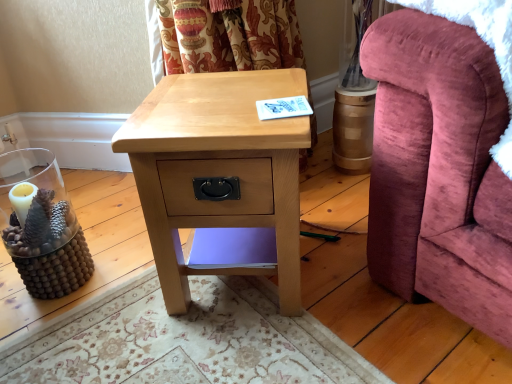
Measure the distance between natural wood nightstand at center and camera.

natural wood nightstand at center and camera are 73.53 centimeters apart.

Measure the distance between point (174, 128) and camera.

Point (174, 128) is 30.39 inches from camera.

Describe the element at coordinates (220, 176) in the screenshot. I see `natural wood nightstand at center` at that location.

I want to click on natural wood nightstand at center, so click(220, 176).

This screenshot has height=384, width=512. Identify the location of velvet pink armchair at right. (439, 169).

Consider the image. What is the approximate height of velvet pink armchair at right?

velvet pink armchair at right is 38.85 centimeters in height.

The width and height of the screenshot is (512, 384). Describe the element at coordinates (439, 169) in the screenshot. I see `velvet pink armchair at right` at that location.

Where is `natural wood nightstand at center`? The width and height of the screenshot is (512, 384). natural wood nightstand at center is located at coordinates (220, 176).

Looking at this image, does velvet pink armchair at right appear on the right side of natural wood nightstand at center?

Yes.

Looking at this image, considering their positions, is velvet pink armchair at right located in front of or behind natural wood nightstand at center?

Visually, velvet pink armchair at right is located in front of natural wood nightstand at center.

Between point (399, 28) and point (187, 155), which one is positioned in front?

The point (399, 28) is more forward.

From the image's perspective, which is above, velvet pink armchair at right or natural wood nightstand at center?

velvet pink armchair at right is shown above in the image.

From the picture: From a real-world perspective, is velvet pink armchair at right over natural wood nightstand at center?

Yes, from a real-world perspective, velvet pink armchair at right is over natural wood nightstand at center

Which object is thinner, velvet pink armchair at right or natural wood nightstand at center?

natural wood nightstand at center is thinner.

Between velvet pink armchair at right and natural wood nightstand at center, which one has less height?

velvet pink armchair at right.

Who is smaller, velvet pink armchair at right or natural wood nightstand at center?

Smaller between the two is natural wood nightstand at center.

Is velvet pink armchair at right spatially inside natural wood nightstand at center, or outside of it?

velvet pink armchair at right is located beyond the bounds of natural wood nightstand at center.

Are velvet pink armchair at right and natural wood nightstand at center located far from each other?

velvet pink armchair at right is actually quite close to natural wood nightstand at center.

Based on the photo, is velvet pink armchair at right turned away from natural wood nightstand at center?

That's not correct — velvet pink armchair at right is not looking away from natural wood nightstand at center.

Can you tell me how much velvet pink armchair at right and natural wood nightstand at center differ in facing direction?

The angle between the facing direction of velvet pink armchair at right and the facing direction of natural wood nightstand at center is 29.4 degrees.

This screenshot has height=384, width=512. Identify the location of furniture in front of the natural wood nightstand at center. (439, 169).

Which object is positioned more to the right, natural wood nightstand at center or velvet pink armchair at right?

velvet pink armchair at right.

Between natural wood nightstand at center and velvet pink armchair at right, which one is positioned in front?

velvet pink armchair at right is more forward.

Considering the points (241, 169) and (469, 52), which point is in front, point (241, 169) or point (469, 52)?

The point (469, 52) is in front.

From the image's perspective, between natural wood nightstand at center and velvet pink armchair at right, which one is located above?

velvet pink armchair at right appears higher in the image.

From a real-world perspective, is natural wood nightstand at center under velvet pink armchair at right?

Yes.

Can you confirm if natural wood nightstand at center is thinner than velvet pink armchair at right?

Yes, natural wood nightstand at center is thinner than velvet pink armchair at right.

Which of these two, natural wood nightstand at center or velvet pink armchair at right, stands shorter?

With less height is velvet pink armchair at right.

In terms of size, does natural wood nightstand at center appear bigger or smaller than velvet pink armchair at right?

In the image, natural wood nightstand at center appears to be smaller than velvet pink armchair at right.

Is natural wood nightstand at center positioned beyond the bounds of velvet pink armchair at right?

natural wood nightstand at center is positioned outside velvet pink armchair at right.

Is natural wood nightstand at center in contact with velvet pink armchair at right?

natural wood nightstand at center is not next to velvet pink armchair at right, and they're not touching.

Does natural wood nightstand at center turn towards velvet pink armchair at right?

No, natural wood nightstand at center is not aimed at velvet pink armchair at right.

What's the angular difference between natural wood nightstand at center and velvet pink armchair at right's facing directions?

29.4 degrees separate the facing orientations of natural wood nightstand at center and velvet pink armchair at right.

The width and height of the screenshot is (512, 384). I want to click on nightstand behind the velvet pink armchair at right, so click(x=220, y=176).

Locate an element on the screen. nightstand below the velvet pink armchair at right (from the image's perspective) is located at coordinates (220, 176).

This screenshot has height=384, width=512. In order to click on furniture on the right of natural wood nightstand at center in this screenshot , I will do `click(439, 169)`.